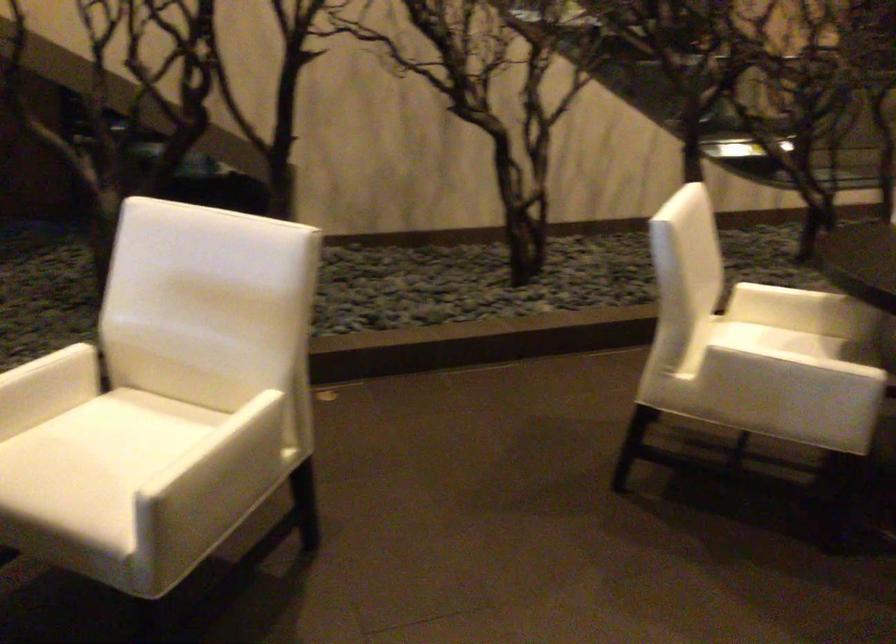
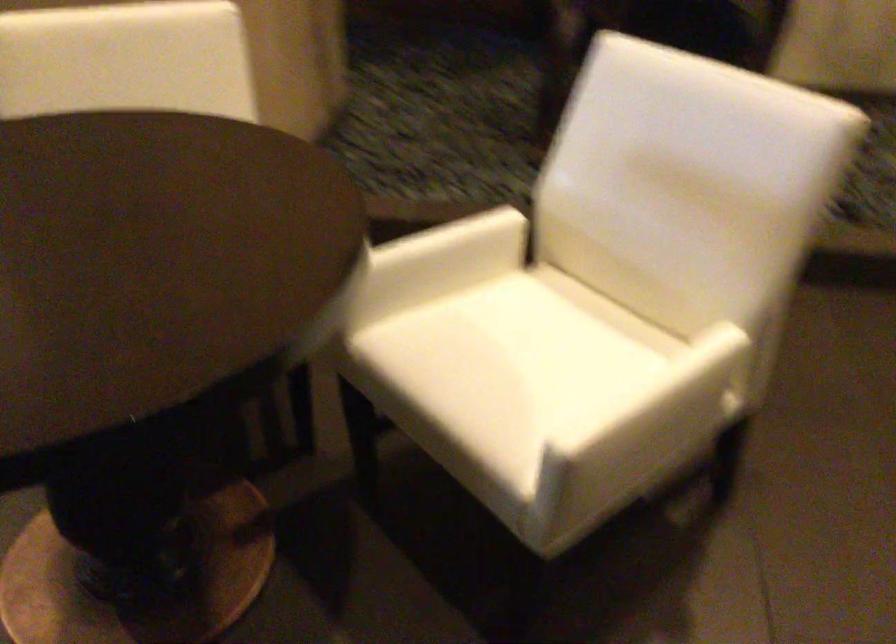
Locate, in the second image, the point that corresponds to (119,449) in the first image.

(533, 348)